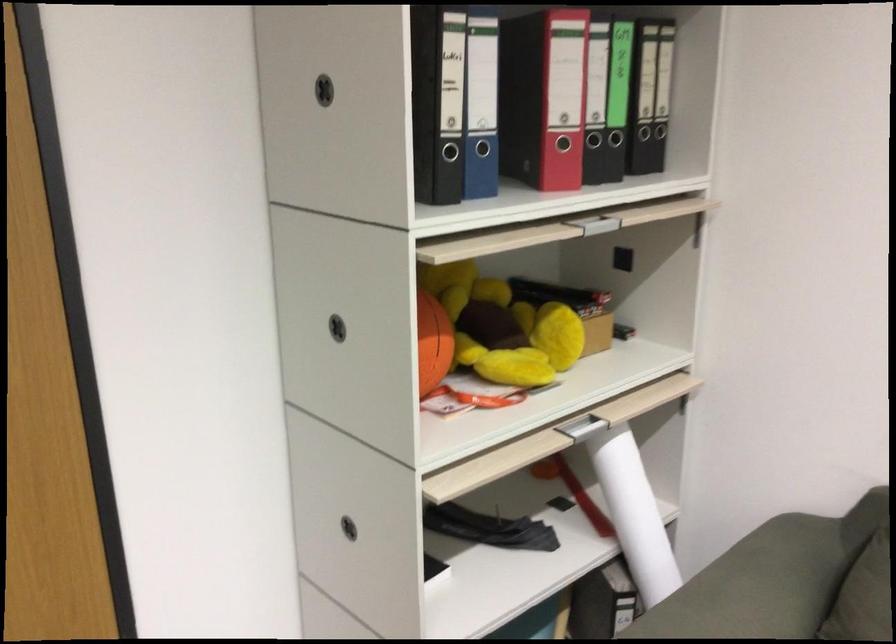
Image resolution: width=896 pixels, height=644 pixels. Identify the location of drawer handle. (743, 260).